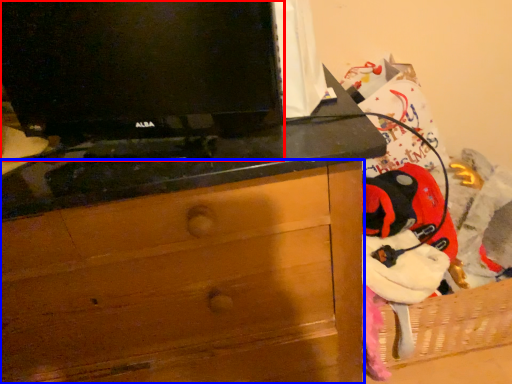
Question: Which of the following is the closest to the observer, television (highlighted by a red box) or chest of drawers (highlighted by a blue box)?

Choices:
 (A) television
 (B) chest of drawers

Answer: (A)